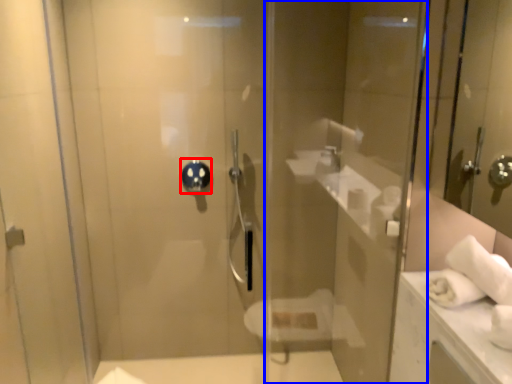
Question: Which object is further to the camera taking this photo, shower (highlighted by a red box) or glass door (highlighted by a blue box)?

Choices:
 (A) shower
 (B) glass door

Answer: (A)